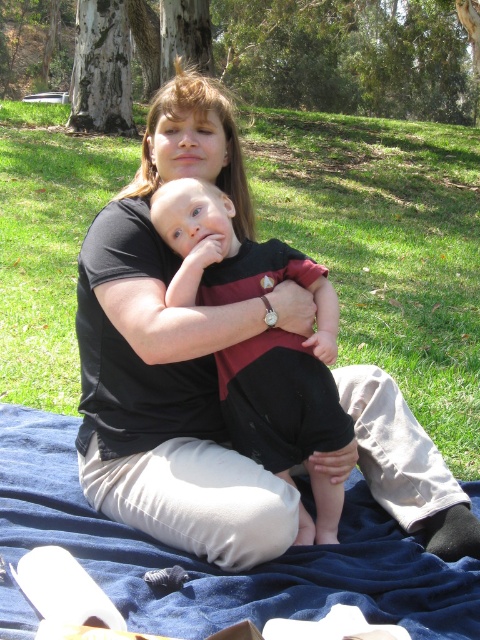
You are planning to place a small picnic basket on the blue fabric blanket at lower center. However, there is a matte black baby at center on top of the blanket. Can you place the basket there without disturbing the baby?

The blue fabric blanket at lower center is located below matte black baby at center, so placing the basket on the blanket would require moving the baby first to avoid disturbing them.

You are planning a picnic and need to choose between the green grass at center and the blue fabric blanket at lower center as a seating area. Which option provides more space for spreading out your picnic items?

The green grass at center is larger in size than the blue fabric blanket at lower center, so it provides more space for spreading out your picnic items.

You are planning to set up a small tent in the area where the green grass at center and the matte black baby at center are located. Considering the height of the grass, will the baby be visible from above the grass?

The green grass at center is taller than the matte black baby at center, so the baby might not be fully visible from above the grass due to the grass height.